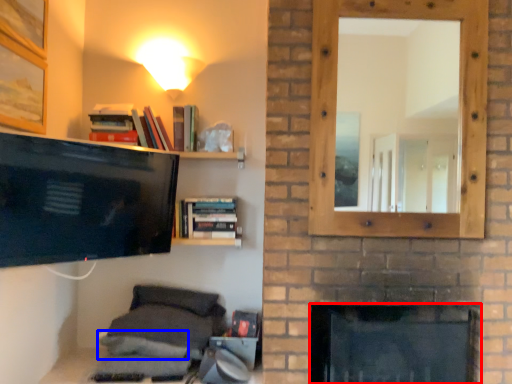
Question: Which of the following is the farthest to the observer, fireplace (highlighted by a red box) or pillow (highlighted by a blue box)?

Choices:
 (A) fireplace
 (B) pillow

Answer: (B)